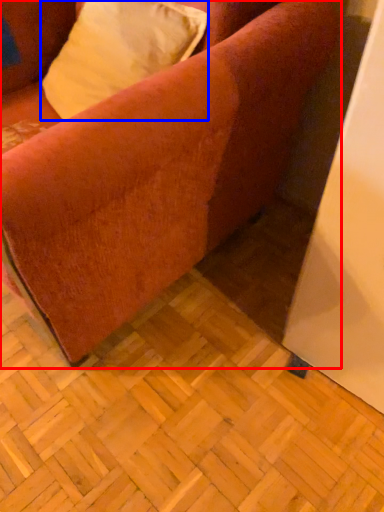
Question: Among these objects, which one is nearest to the camera, studio couch (highlighted by a red box) or pillow (highlighted by a blue box)?

Choices:
 (A) studio couch
 (B) pillow

Answer: (A)